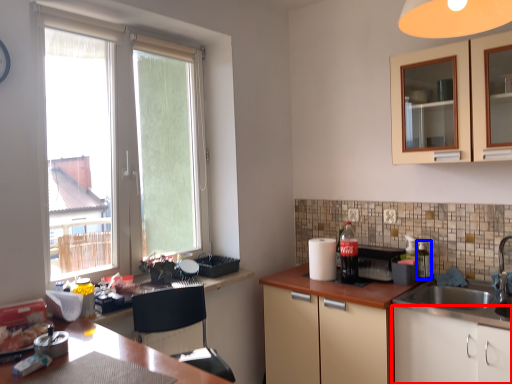
Question: Which object appears closest to the camera in this image, cabinetry (highlighted by a red box) or bottle (highlighted by a blue box)?

Choices:
 (A) cabinetry
 (B) bottle

Answer: (A)